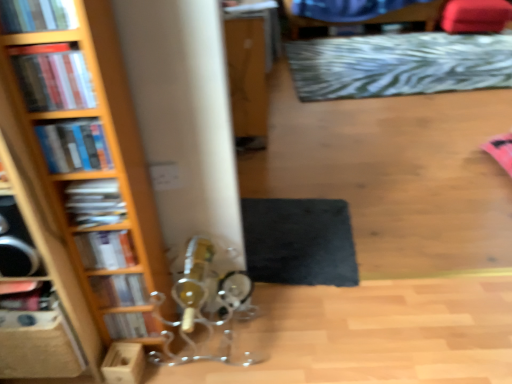
The image size is (512, 384). Identify the location of spots to the right of wooden box at lower left. (187, 370).